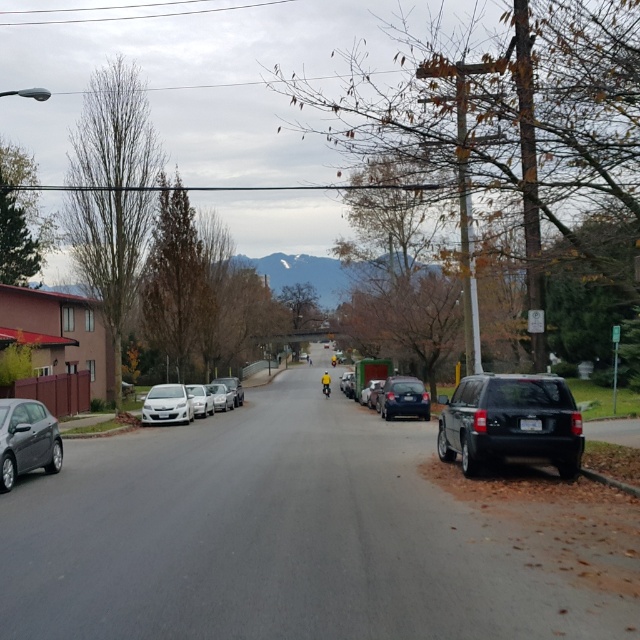
Question: Which object appears farthest from the camera in this image?

Choices:
 (A) shiny dark blue sedan at center
 (B) white matte sedan at center
 (C) matte black car at center
 (D) satin silver sedan at left

Answer: (C)

Question: Does black matte suv at right appear on the right side of matte black car at center?

Choices:
 (A) yes
 (B) no

Answer: (A)

Question: Estimate the real-world distances between objects in this image. Which object is farther from the silver metallic sedan at center-left?

Choices:
 (A) matte black car at left
 (B) black matte suv at right

Answer: (A)

Question: From the image, what is the correct spatial relationship of shiny dark blue sedan at center in relation to satin silver sedan at left?

Choices:
 (A) below
 (B) above

Answer: (B)

Question: Does shiny dark blue sedan at center appear under silver metallic sedan at center-left?

Choices:
 (A) yes
 (B) no

Answer: (B)

Question: Based on their relative distances, which object is nearer to the white matte sedan at center?

Choices:
 (A) silver metallic sedan at center-left
 (B) matte black car at left
 (C) matte black car at center

Answer: (A)